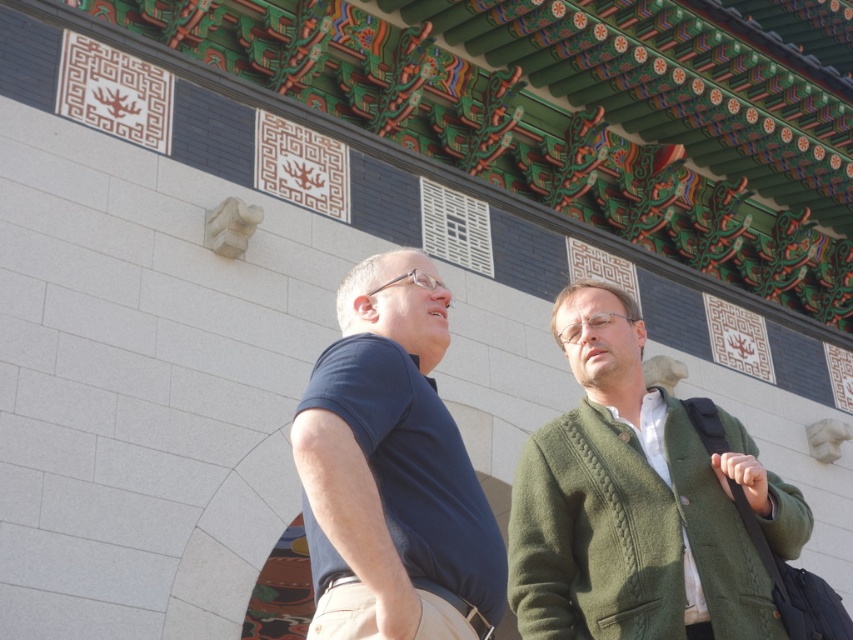
Question: Which of the following is the closest to the observer?

Choices:
 (A) dark blue shirt at center
 (B) green knitted sweater at right

Answer: (A)

Question: Among these points, which one is nearest to the camera?

Choices:
 (A) (405, 525)
 (B) (602, 532)

Answer: (A)

Question: Does green knitted sweater at right appear over dark blue shirt at center?

Choices:
 (A) no
 (B) yes

Answer: (A)

Question: Is the position of green knitted sweater at right less distant than that of dark blue shirt at center?

Choices:
 (A) yes
 (B) no

Answer: (B)

Question: Is green knitted sweater at right to the right of dark blue shirt at center from the viewer's perspective?

Choices:
 (A) yes
 (B) no

Answer: (A)